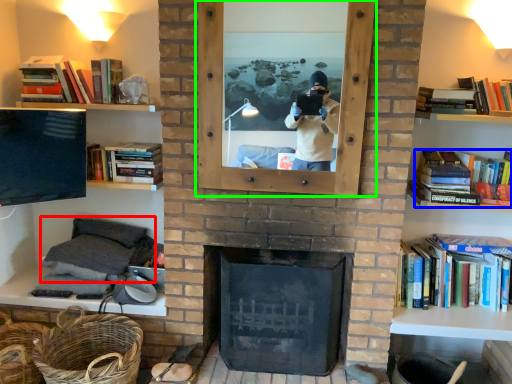
Question: Which object is positioned farthest from sit (highlighted by a red box)? Select from book (highlighted by a blue box) and picture frame (highlighted by a green box).

Choices:
 (A) book
 (B) picture frame

Answer: (A)